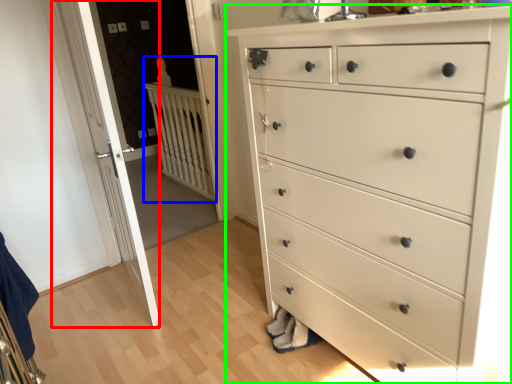
Question: Estimate the real-world distances between objects in this image. Which object is closer to door (highlighted by a red box), balustrade (highlighted by a blue box) or chest of drawers (highlighted by a green box)?

Choices:
 (A) balustrade
 (B) chest of drawers

Answer: (B)